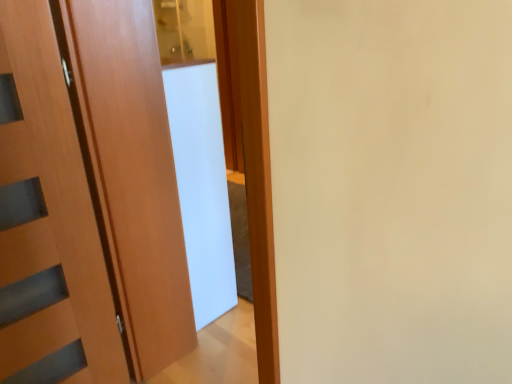
The width and height of the screenshot is (512, 384). Find the location of `white glossy screen door at center`. white glossy screen door at center is located at coordinates (202, 187).

Measure the distance between point (231, 261) and camera.

A distance of 6.98 feet exists between point (231, 261) and camera.

What do you see at coordinates (202, 187) in the screenshot?
I see `white glossy screen door at center` at bounding box center [202, 187].

Locate an element on the screen. wooden door at left is located at coordinates (47, 220).

The height and width of the screenshot is (384, 512). Describe the element at coordinates (47, 220) in the screenshot. I see `wooden door at left` at that location.

I want to click on white glossy screen door at center, so click(x=202, y=187).

Considering the relative positions of white glossy screen door at center and wooden door at left in the image provided, is white glossy screen door at center to the left of wooden door at left from the viewer's perspective?

No, white glossy screen door at center is not to the left of wooden door at left.

In the image, is white glossy screen door at center positioned in front of or behind wooden door at left?

Clearly, white glossy screen door at center is behind wooden door at left.

Is point (209, 223) less distant than point (18, 219)?

No, it is behind (18, 219).

From the image's perspective, who appears lower, white glossy screen door at center or wooden door at left?

wooden door at left is shown below in the image.

From a real-world perspective, who is located lower, white glossy screen door at center or wooden door at left?

white glossy screen door at center.

Considering the sizes of white glossy screen door at center and wooden door at left in the image, is white glossy screen door at center wider or thinner than wooden door at left?

Considering their sizes, white glossy screen door at center looks slimmer than wooden door at left.

Is white glossy screen door at center taller or shorter than wooden door at left?

white glossy screen door at center is shorter than wooden door at left.

Is white glossy screen door at center smaller than wooden door at left?

Yes, white glossy screen door at center is smaller than wooden door at left.

Choose the correct answer: Is white glossy screen door at center inside wooden door at left or outside it?

white glossy screen door at center exists outside the volume of wooden door at left.

Would you say white glossy screen door at center is a long distance from wooden door at left?

No.

Is wooden door at left at the back of white glossy screen door at center?

No, white glossy screen door at center's orientation is not away from wooden door at left.

This screenshot has width=512, height=384. In order to click on door that is on the left side of white glossy screen door at center in this screenshot , I will do `click(47, 220)`.

Considering the relative positions of wooden door at left and white glossy screen door at center in the image provided, is wooden door at left to the right of white glossy screen door at center from the viewer's perspective?

Incorrect, wooden door at left is not on the right side of white glossy screen door at center.

Which is in front, wooden door at left or white glossy screen door at center?

wooden door at left is in front.

Is point (79, 371) in front of point (207, 66)?

Yes, it is.

From the image's perspective, is wooden door at left beneath white glossy screen door at center?

Yes.

From a real-world perspective, is wooden door at left positioned above or below white glossy screen door at center?

wooden door at left is situated higher than white glossy screen door at center in the real world.

Considering the sizes of objects wooden door at left and white glossy screen door at center in the image provided, who is thinner, wooden door at left or white glossy screen door at center?

white glossy screen door at center is thinner.

From their relative heights in the image, would you say wooden door at left is taller or shorter than white glossy screen door at center?

wooden door at left is taller than white glossy screen door at center.

Can you confirm if wooden door at left is bigger than white glossy screen door at center?

Yes.

Is wooden door at left spatially inside white glossy screen door at center, or outside of it?

wooden door at left is spatially situated outside white glossy screen door at center.

Is the surface of wooden door at left in direct contact with white glossy screen door at center?

No, wooden door at left is not next to white glossy screen door at center.

Does wooden door at left turn towards white glossy screen door at center?

No, wooden door at left is not turned towards white glossy screen door at center.

Measure the distance between wooden door at left and white glossy screen door at center.

A distance of 21.71 inches exists between wooden door at left and white glossy screen door at center.

You are a GUI agent. You are given a task and a screenshot of the screen. Output one action in this format:
    pyautogui.click(x=<x>, y=<y>)
    Task: Click on the screen door directly beneath the wooden door at left (from a real-world perspective)
    The width and height of the screenshot is (512, 384).
    Given the screenshot: What is the action you would take?
    pyautogui.click(x=202, y=187)

At what (x,y) coordinates should I click in order to perform the action: click on screen door located above the wooden door at left (from the image's perspective). Please return your answer as a coordinate pair (x, y). The image size is (512, 384). Looking at the image, I should click on (202, 187).

Locate an element on the screen. The image size is (512, 384). screen door on the right of wooden door at left is located at coordinates (202, 187).